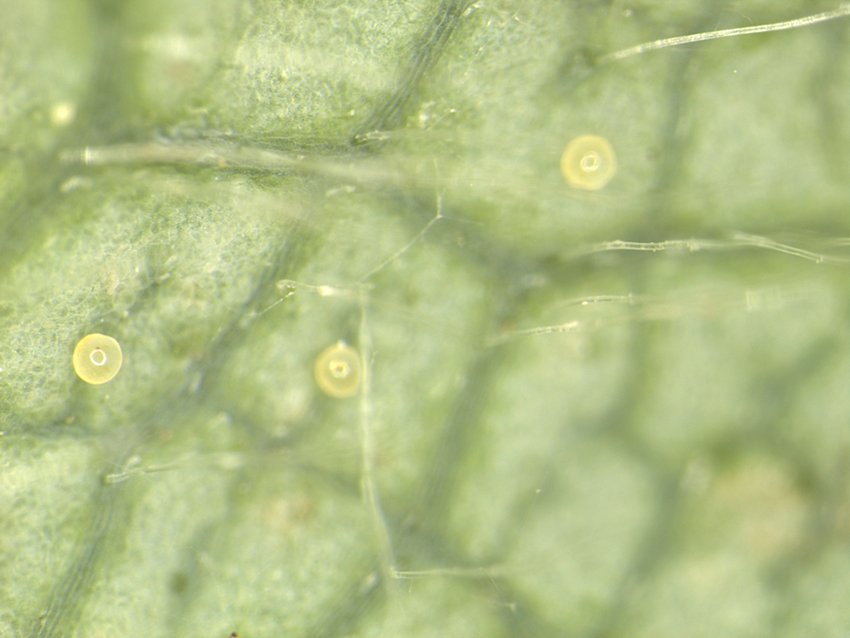
The height and width of the screenshot is (638, 850). I want to click on yellow trim, so click(91, 383), click(348, 390), click(337, 374), click(102, 360), click(601, 181), click(593, 165).